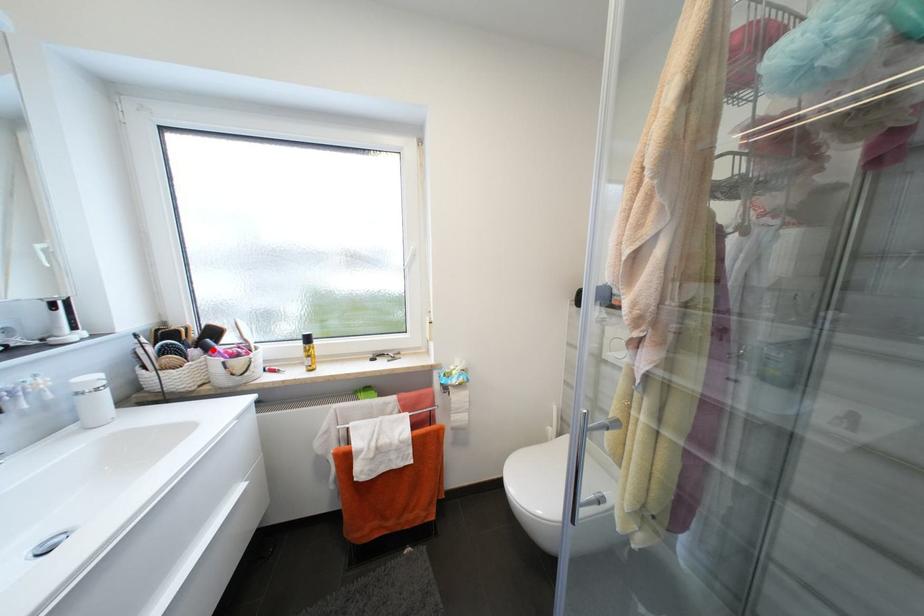
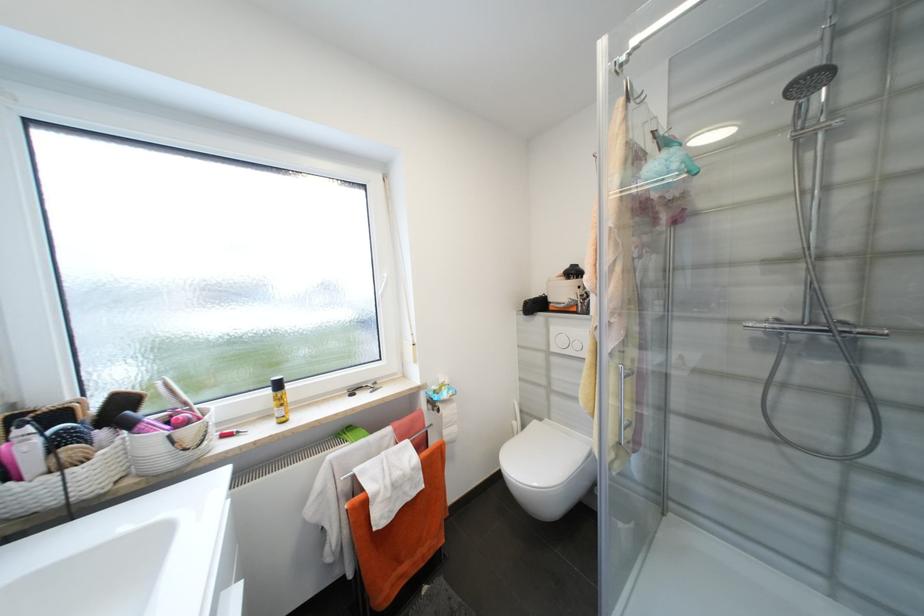
In the second image, find the point that corresponds to the highlighted location in the first image.

(134, 427)